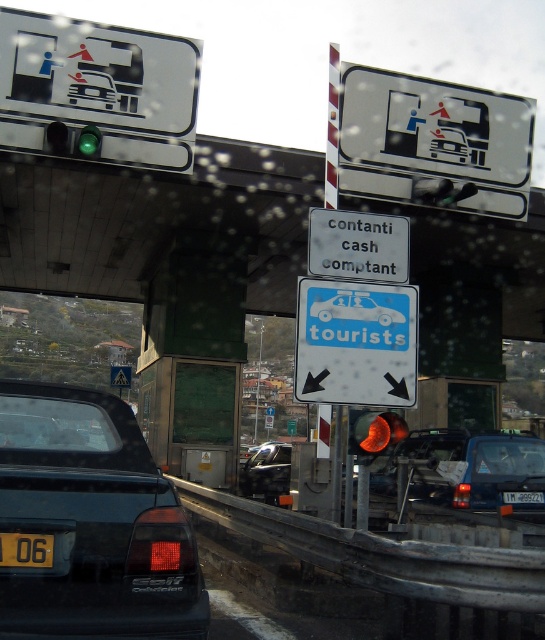
Based on the photo, you are driving a car and see the white plastic sign at center and the yellow reflective triangle at center ahead on the road. Which object is positioned to the right side from your perspective?

The white plastic sign at center is to the right of the yellow reflective triangle at center.

You are driving a car and see the matte black car at lower left and the white plastic sign at center. Which object is closer to the left side of the road?

The matte black car at lower left is closer to the left side of the road because it is positioned to the left of the white plastic sign at center.